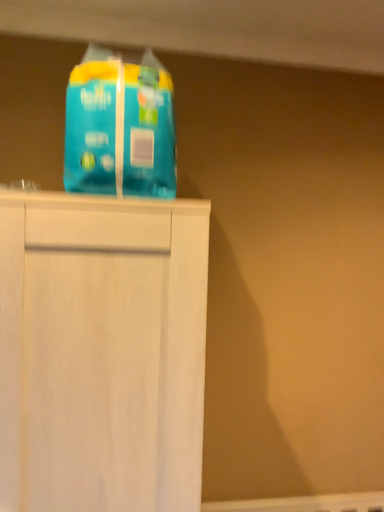
At what (x,y) coordinates should I click in order to perform the action: click on blue matte diaper pack at upper center. Please return your answer as a coordinate pair (x, y). This screenshot has width=384, height=512. Looking at the image, I should click on (120, 126).

The image size is (384, 512). Describe the element at coordinates (120, 126) in the screenshot. I see `blue matte diaper pack at upper center` at that location.

I want to click on blue matte diaper pack at upper center, so click(x=120, y=126).